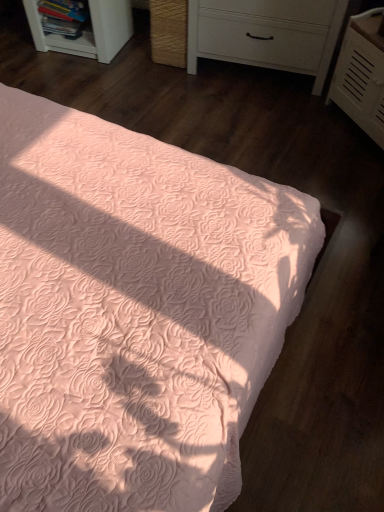
Where is `free location in front of white matte chest of drawers at upper center, which ranks as the first chest of drawers in left-to-right order`? free location in front of white matte chest of drawers at upper center, which ranks as the first chest of drawers in left-to-right order is located at coordinates (231, 129).